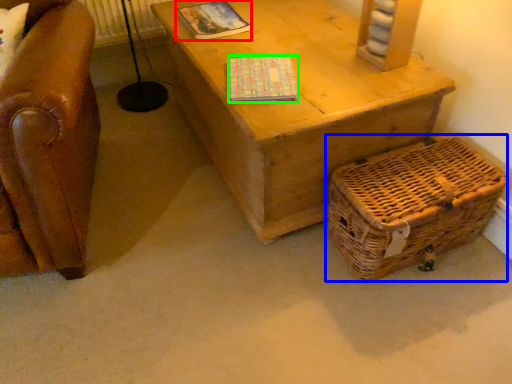
Question: Which object is the closest to the magazine (highlighted by a red box)? Choose among these: basket (highlighted by a blue box) or magazine (highlighted by a green box).

Choices:
 (A) basket
 (B) magazine

Answer: (B)